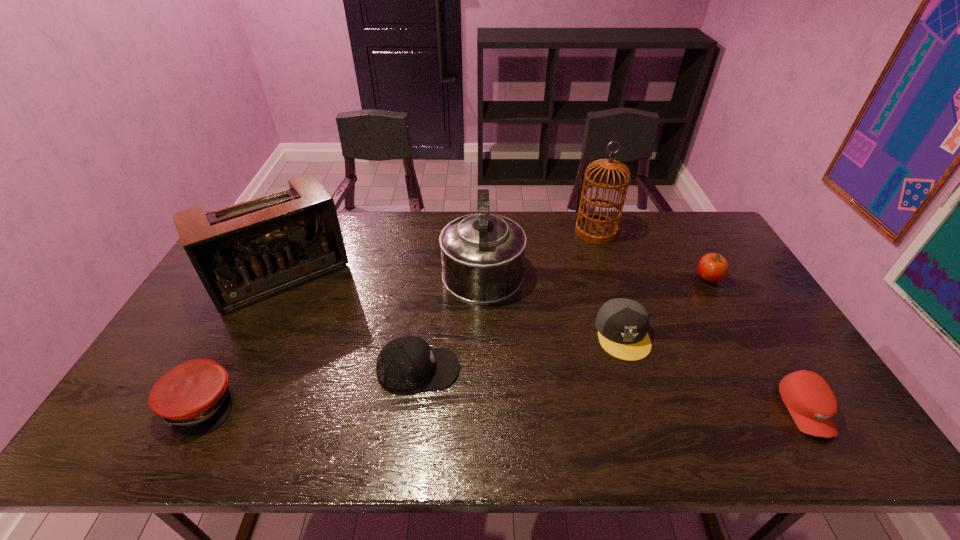
Find the location of a particular element. apple at the right edge is located at coordinates (712, 267).

At what (x,y) coordinates should I click in order to perform the action: click on cap located at the right edge. Please return your answer as a coordinate pair (x, y). The width and height of the screenshot is (960, 540). Looking at the image, I should click on (810, 400).

Where is `object present at the far left corner`? Image resolution: width=960 pixels, height=540 pixels. object present at the far left corner is located at coordinates (247, 252).

The width and height of the screenshot is (960, 540). I want to click on object located in the near left corner section of the desktop, so click(x=194, y=397).

Where is `object at the near right corner`? The height and width of the screenshot is (540, 960). object at the near right corner is located at coordinates 810,400.

In the image, there is a desktop. Identify the location of free space at the far edge. (634, 239).

The image size is (960, 540). In the image, there is a desktop. Identify the location of free space at the near edge. (274, 442).

You are a GUI agent. You are given a task and a screenshot of the screen. Output one action in this format:
    pyautogui.click(x=<x>, y=<y>)
    Task: Click on the vacant region at the right edge of the desktop
    
    Given the screenshot: What is the action you would take?
    (762, 340)

Find the location of `vacant area at the far right corner of the desktop`. vacant area at the far right corner of the desktop is located at coordinates (714, 249).

The image size is (960, 540). Find the location of `unoccupied area between the leftmost cap and the apple`. unoccupied area between the leftmost cap and the apple is located at coordinates (454, 341).